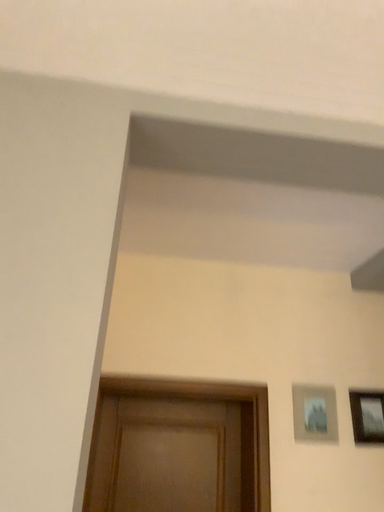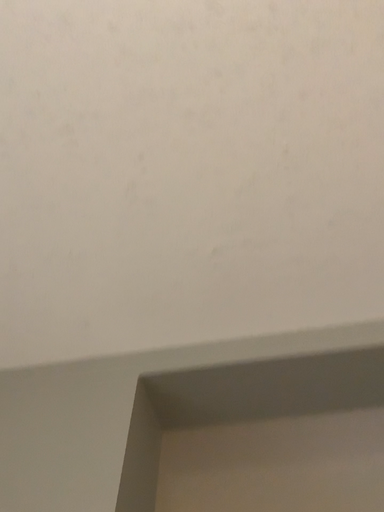
Question: How did the camera likely rotate when shooting the video?

Choices:
 (A) rotated downward
 (B) rotated upward

Answer: (B)